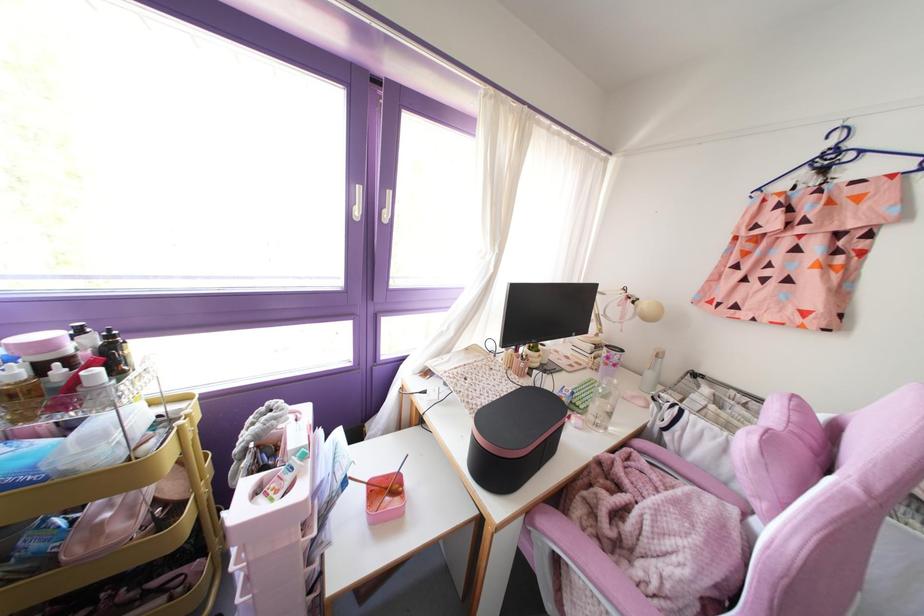
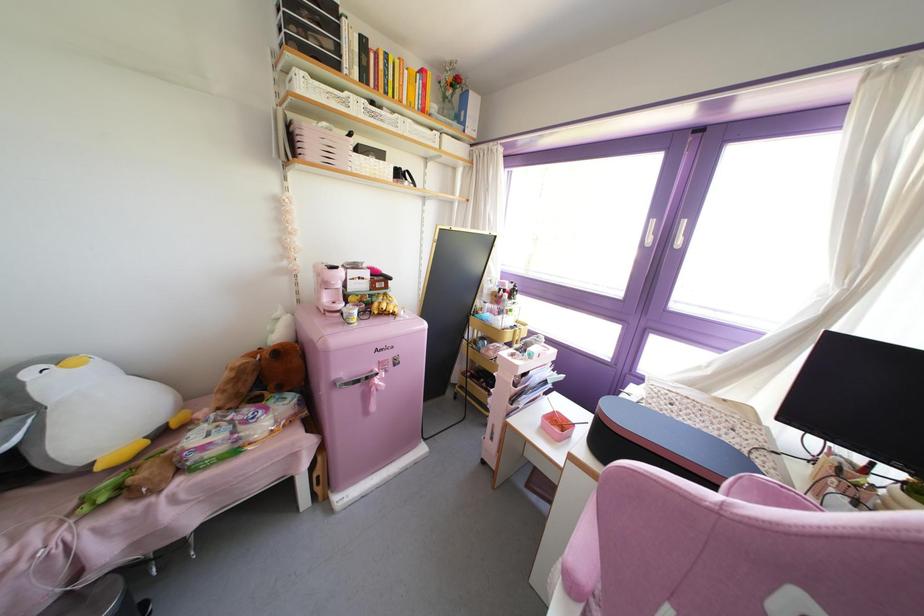
Find the pixel in the second image that matches pixel 383 476 in the first image.

(565, 418)